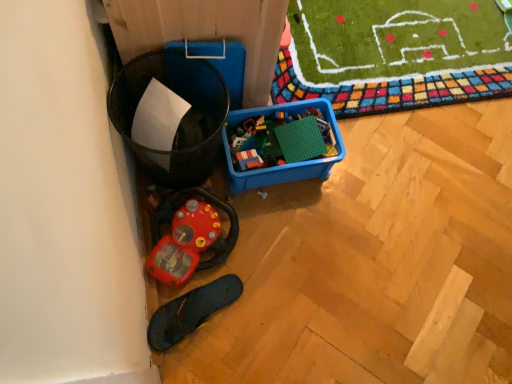
The height and width of the screenshot is (384, 512). What do you see at coordinates (184, 243) in the screenshot? I see `rubberized plastic toy at lower left, arranged as the 1th toy when viewed from the left` at bounding box center [184, 243].

Where is `black rubber slipper at lower left`? black rubber slipper at lower left is located at coordinates (191, 311).

From the image's perspective, is rubberized plastic toy at lower left, placed as the 1th toy when sorted from bottom to top, located above or below green matte building blocks at center, which is the first toy in top-to-bottom order?

Based on their image positions, rubberized plastic toy at lower left, placed as the 1th toy when sorted from bottom to top, is located beneath green matte building blocks at center, which is the first toy in top-to-bottom order.

From a real-world perspective, between rubberized plastic toy at lower left, which ranks as the second toy in top-to-bottom order, and green matte building blocks at center, which ranks as the 2th toy in left-to-right order, who is vertically higher?

From a 3D spatial view, green matte building blocks at center, which ranks as the 2th toy in left-to-right order, is above.

Between rubberized plastic toy at lower left, which is the 2th toy from right to left, and green matte building blocks at center, which ranks as the 2th toy in left-to-right order, which one is positioned behind?

green matte building blocks at center, which ranks as the 2th toy in left-to-right order, is more distant.

Considering the points (197, 252) and (314, 152), which point is behind, point (197, 252) or point (314, 152)?

The point (314, 152) is behind.

Who is bigger, green matte building blocks at center, acting as the 1th toy starting from the right, or rubberized plastic toy at lower left, which ranks as the second toy in top-to-bottom order?

Bigger between the two is rubberized plastic toy at lower left, which ranks as the second toy in top-to-bottom order.

Consider the image. Is green matte building blocks at center, acting as the 1th toy starting from the right, not close to rubberized plastic toy at lower left, which is the 2th toy from right to left?

green matte building blocks at center, acting as the 1th toy starting from the right, is near rubberized plastic toy at lower left, which is the 2th toy from right to left, not far away.

Considering the positions of point (232, 132) and point (201, 245), is point (232, 132) closer or farther from the camera than point (201, 245)?

Point (232, 132) is positioned farther from the camera compared to point (201, 245).

Looking at the image, does rubberized plastic toy at lower left, arranged as the 1th toy when viewed from the left, seem bigger or smaller compared to black rubber slipper at lower left?

Clearly, rubberized plastic toy at lower left, arranged as the 1th toy when viewed from the left, is larger in size than black rubber slipper at lower left.

From the image's perspective, does rubberized plastic toy at lower left, placed as the 1th toy when sorted from bottom to top, appear lower than black rubber slipper at lower left?

Actually, rubberized plastic toy at lower left, placed as the 1th toy when sorted from bottom to top, appears above black rubber slipper at lower left in the image.

From a real-world perspective, which object stands above the other?

rubberized plastic toy at lower left, arranged as the 1th toy when viewed from the left.

Does rubberized plastic toy at lower left, which is the 2th toy from right to left, appear on the right side of black rubber slipper at lower left?

Incorrect, rubberized plastic toy at lower left, which is the 2th toy from right to left, is not on the right side of black rubber slipper at lower left.

Looking at this image, is rubberized plastic toy at lower left, which ranks as the second toy in top-to-bottom order, a part of black rubber slipper at lower left?

That's incorrect, rubberized plastic toy at lower left, which ranks as the second toy in top-to-bottom order, is not inside black rubber slipper at lower left.

Could you tell me if black rubber slipper at lower left is facing rubberized plastic toy at lower left, arranged as the 1th toy when viewed from the left?

No, black rubber slipper at lower left is not turned towards rubberized plastic toy at lower left, arranged as the 1th toy when viewed from the left.

How many degrees apart are the facing directions of black rubber slipper at lower left and rubberized plastic toy at lower left, which ranks as the second toy in top-to-bottom order?

There is a 32.1-degree angle between the facing directions of black rubber slipper at lower left and rubberized plastic toy at lower left, which ranks as the second toy in top-to-bottom order.

Is black rubber slipper at lower left smaller than rubberized plastic toy at lower left, which is the 2th toy from right to left?

Yes, black rubber slipper at lower left is smaller than rubberized plastic toy at lower left, which is the 2th toy from right to left.

Which object is closer to the camera, green matte building blocks at center, which is the first toy in top-to-bottom order, or black rubber slipper at lower left?

black rubber slipper at lower left is more forward.

Is green matte building blocks at center, which ranks as the 2th toy in left-to-right order, spatially inside black rubber slipper at lower left, or outside of it?

green matte building blocks at center, which ranks as the 2th toy in left-to-right order, is spatially situated outside black rubber slipper at lower left.

Is green matte building blocks at center, which ranks as the 2th toy in left-to-right order, aimed at black rubber slipper at lower left?

No, green matte building blocks at center, which ranks as the 2th toy in left-to-right order, is not turned towards black rubber slipper at lower left.

From the image's perspective, is green matte building blocks at center, which ranks as the 2th toy in bottom-to-top order, on top of black rubber slipper at lower left?

Correct, green matte building blocks at center, which ranks as the 2th toy in bottom-to-top order, appears higher than black rubber slipper at lower left in the image.

Is black rubber slipper at lower left touching green matte building blocks at center, which ranks as the 2th toy in bottom-to-top order?

No, black rubber slipper at lower left is not beside green matte building blocks at center, which ranks as the 2th toy in bottom-to-top order.

From a real-world perspective, is black rubber slipper at lower left beneath green matte building blocks at center, acting as the 1th toy starting from the right?

A: Yes.

Who is smaller, black rubber slipper at lower left or green matte building blocks at center, which ranks as the 2th toy in bottom-to-top order?

green matte building blocks at center, which ranks as the 2th toy in bottom-to-top order.

From the image's perspective, which is below, black rubber slipper at lower left or green matte building blocks at center, which ranks as the 2th toy in left-to-right order?

black rubber slipper at lower left appears lower in the image.

Where is `toy lying below the green matte building blocks at center, acting as the 1th toy starting from the right (from the image's perspective)`? The width and height of the screenshot is (512, 384). toy lying below the green matte building blocks at center, acting as the 1th toy starting from the right (from the image's perspective) is located at coordinates (184, 243).

Locate an element on the screen. toy in front of the green matte building blocks at center, acting as the 1th toy starting from the right is located at coordinates (184, 243).

Based on their spatial positions, is green matte building blocks at center, which ranks as the 2th toy in left-to-right order, or black rubber slipper at lower left closer to rubberized plastic toy at lower left, which ranks as the second toy in top-to-bottom order?

black rubber slipper at lower left.

From the image, which object appears to be nearer to black rubber slipper at lower left, green matte building blocks at center, which is the first toy in top-to-bottom order, or rubberized plastic toy at lower left, which ranks as the second toy in top-to-bottom order?

rubberized plastic toy at lower left, which ranks as the second toy in top-to-bottom order, is positioned closer to the anchor black rubber slipper at lower left.

Estimate the real-world distances between objects in this image. Which object is closer to green matte building blocks at center, which ranks as the 2th toy in bottom-to-top order, rubberized plastic toy at lower left, arranged as the 1th toy when viewed from the left, or black rubber slipper at lower left?

Based on the image, rubberized plastic toy at lower left, arranged as the 1th toy when viewed from the left, appears to be nearer to green matte building blocks at center, which ranks as the 2th toy in bottom-to-top order.

Which object lies nearer to the anchor point black rubber slipper at lower left, rubberized plastic toy at lower left, placed as the 1th toy when sorted from bottom to top, or green matte building blocks at center, acting as the 1th toy starting from the right?

rubberized plastic toy at lower left, placed as the 1th toy when sorted from bottom to top, lies closer to black rubber slipper at lower left than the other object.

Looking at the image, which one is located closer to green matte building blocks at center, which ranks as the 2th toy in left-to-right order, black rubber slipper at lower left or rubberized plastic toy at lower left, which ranks as the second toy in top-to-bottom order?

Based on the image, rubberized plastic toy at lower left, which ranks as the second toy in top-to-bottom order, appears to be nearer to green matte building blocks at center, which ranks as the 2th toy in left-to-right order.

Consider the image. Based on their spatial positions, is black rubber slipper at lower left or green matte building blocks at center, acting as the 1th toy starting from the right, closer to rubberized plastic toy at lower left, arranged as the 1th toy when viewed from the left?

black rubber slipper at lower left is closer to rubberized plastic toy at lower left, arranged as the 1th toy when viewed from the left.

Locate an element on the screen. toy between green matte building blocks at center, which ranks as the 2th toy in bottom-to-top order, and black rubber slipper at lower left vertically is located at coordinates (184, 243).